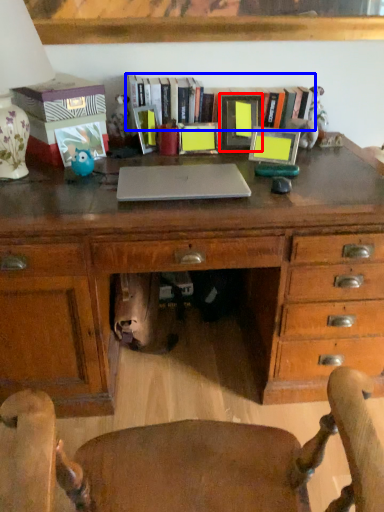
Question: Which object is closer to the camera taking this photo, picture frame (highlighted by a red box) or book (highlighted by a blue box)?

Choices:
 (A) picture frame
 (B) book

Answer: (A)